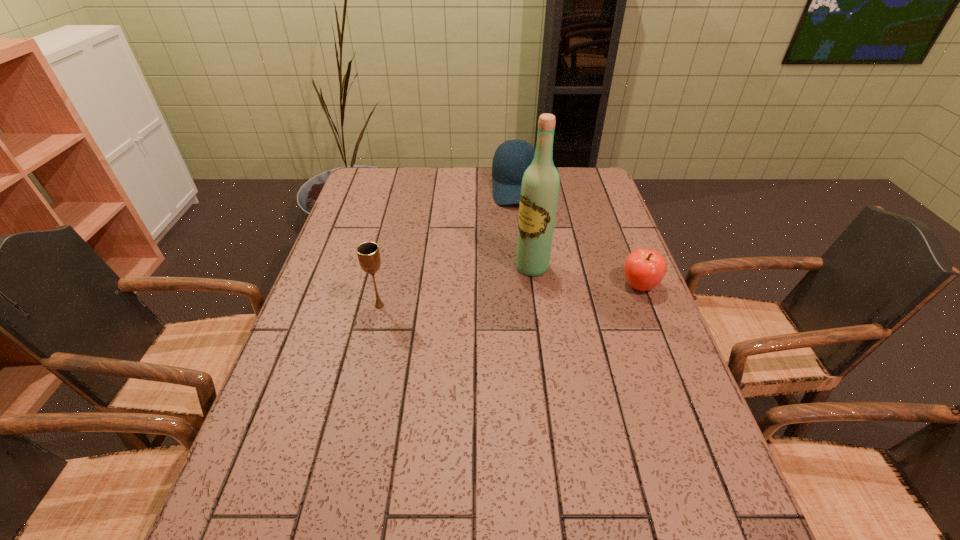
I want to click on the leftmost object, so click(x=368, y=253).

I want to click on the second tallest object, so click(x=368, y=253).

Where is `the rightmost object`? The height and width of the screenshot is (540, 960). the rightmost object is located at coordinates (644, 269).

The width and height of the screenshot is (960, 540). I want to click on apple, so click(x=644, y=269).

Locate an element on the screen. This screenshot has width=960, height=540. baseball cap is located at coordinates (507, 170).

In order to click on the second shortest object in this screenshot , I will do `click(507, 170)`.

This screenshot has width=960, height=540. I want to click on wine bottle, so click(539, 193).

This screenshot has height=540, width=960. In order to click on free location located 0.050m on the right of the third shortest object in this screenshot , I will do `click(408, 306)`.

Locate an element on the screen. free space located 0.250m on the back of the rightmost object is located at coordinates (614, 222).

Locate an element on the screen. free space located on the front-facing side of the farthest object is located at coordinates (518, 242).